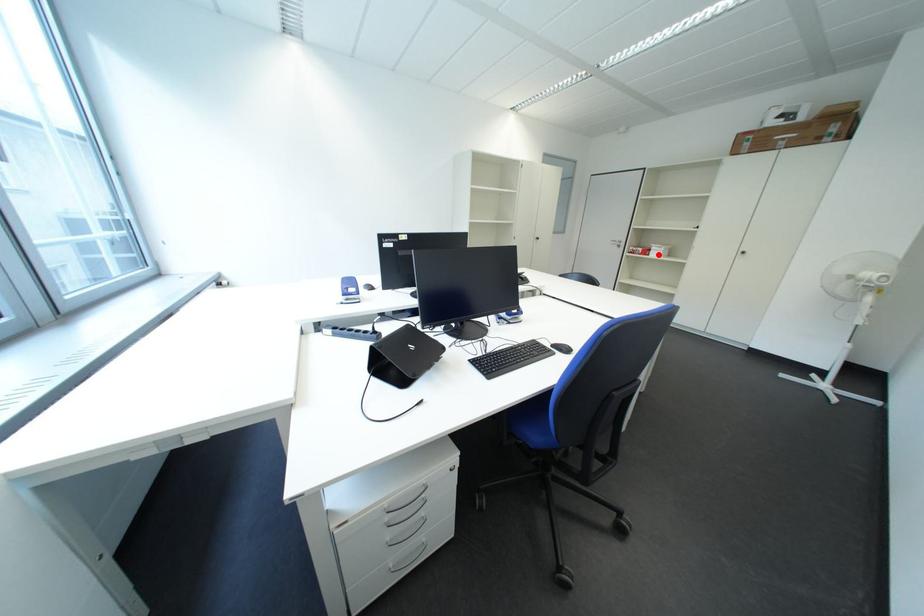
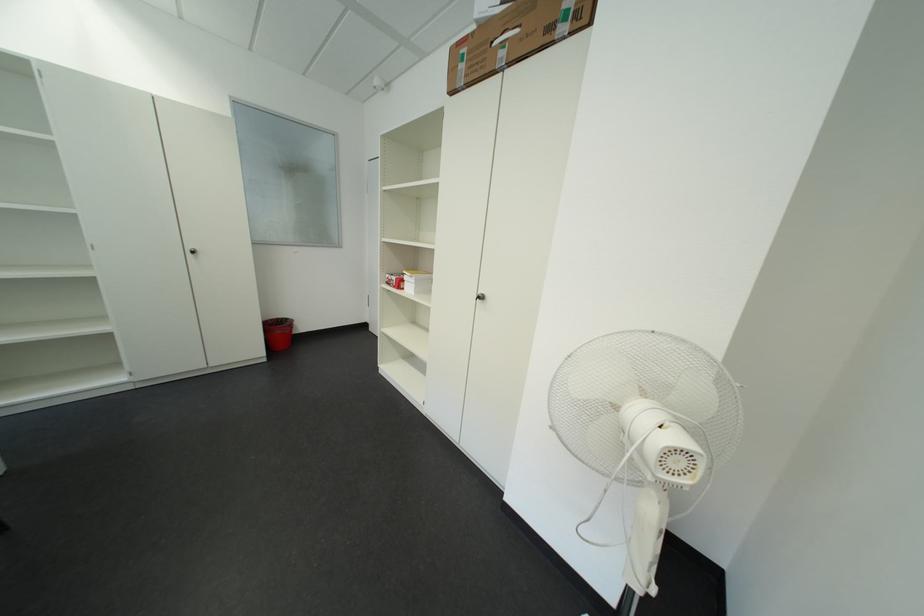
Question: I am providing you with two images of the same scene from different viewpoints. A red point is shown in image1. For the corresponding object point in image2, is it positioned nearer or farther from the camera?

Choices:
 (A) Nearer
 (B) Farther

Answer: (B)